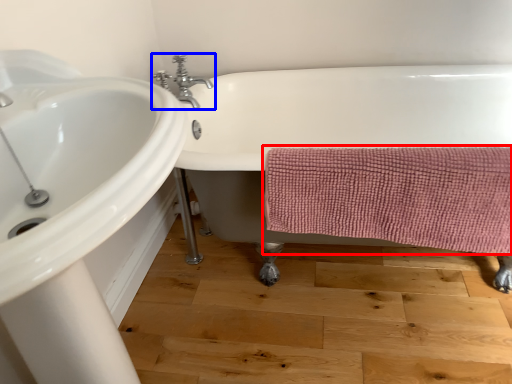
Question: Among these objects, which one is farthest to the camera, bath towel (highlighted by a red box) or tap (highlighted by a blue box)?

Choices:
 (A) bath towel
 (B) tap

Answer: (B)